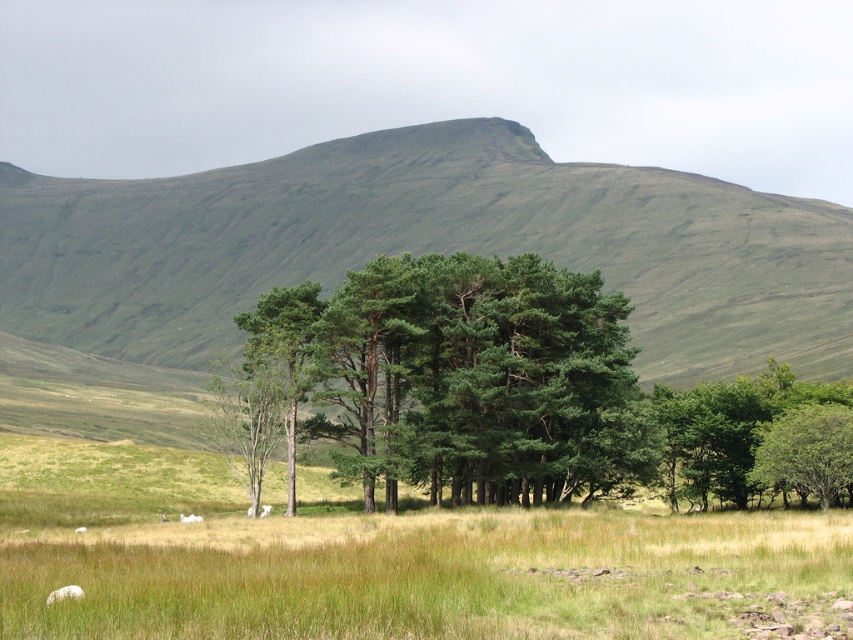
You are a hiker standing at the base of the large rolling hill in the background. You see the green leafy trees at right and the white woolly sheep at lower left. Which object is positioned lower in the image?

The green leafy trees at right is located below the white woolly sheep at lower left, so the green leafy trees at right is positioned lower in the image.

You are a farmer who wants to herd your white woolly sheep at lower left to the green matte trees at center for shade. Given that your sheep can walk 100 feet per minute, how many minutes will it take them to reach the trees?

The green matte trees at center and white woolly sheep at lower left are 214.01 feet apart from each other. At a walking speed of 100 feet per minute, the sheep will take approximately 2.14 minutes to reach the trees.

You are a hiker standing at the base of the green grassy hill at center and want to reach the white woolly sheep at lower left. Which direction should you walk to get there?

The white woolly sheep at lower left is located to the left side of the green grassy hill at center, so you should walk towards the left to reach them.